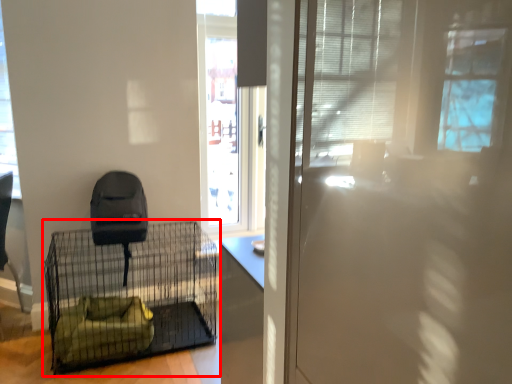
Question: From the image's perspective, considering the relative positions of furniture (annotated by the red box) and window in the image provided, where is furniture (annotated by the red box) located with respect to the staircase?

Choices:
 (A) below
 (B) above

Answer: (A)